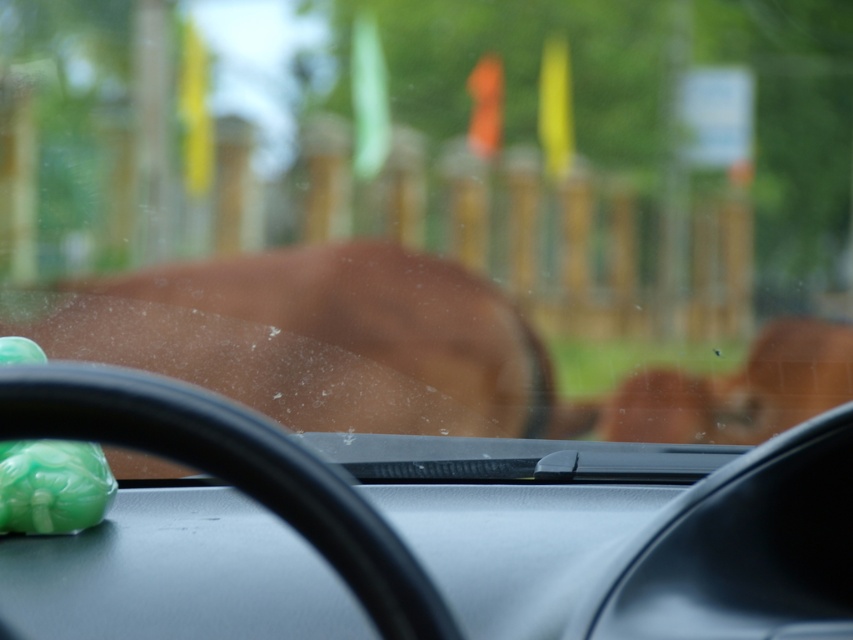
How far apart are brown matte animal at center and green jade ornament at lower left?

They are 35.48 inches apart.

Can you confirm if brown matte animal at center is taller than green jade ornament at lower left?

Yes, brown matte animal at center is taller than green jade ornament at lower left.

Which is behind, point (199, 308) or point (105, 502)?

Positioned behind is point (199, 308).

Where is `brown matte animal at center`? The width and height of the screenshot is (853, 640). brown matte animal at center is located at coordinates (314, 339).